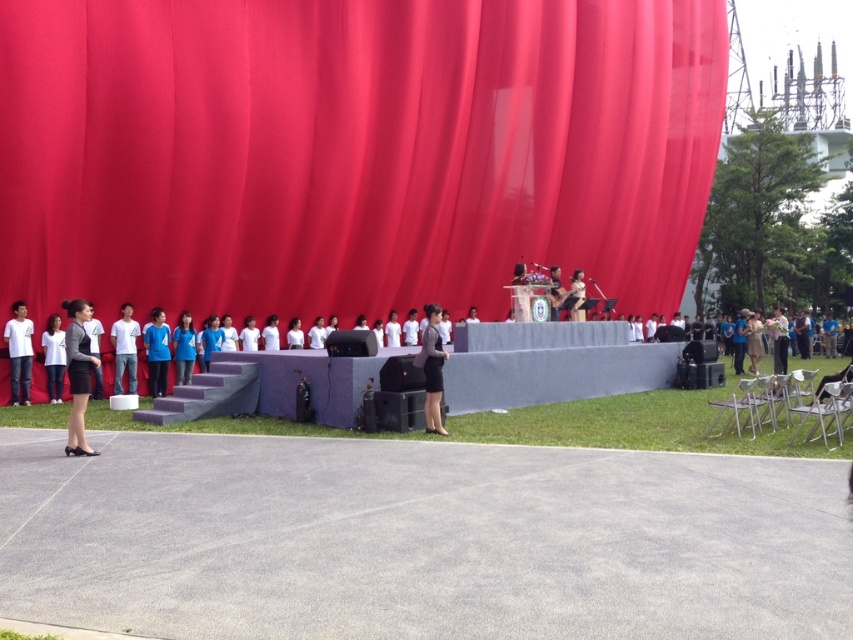
You are an event organizer who needs to place a banner that is 2 meters wide on the stage. The banner must be wider than the white matte shirt at left but narrower than the matte red curtain at center. Is this possible?

The matte red curtain at center is wider than the white matte shirt at left. Since the banner needs to be wider than the white matte shirt at left and narrower than the matte red curtain at center, it is possible as long as the banner is between their widths. The banner at 2 meters could fit if the curtain is wider than 2 meters and the shirt is narrower than 2 meters.

You are standing at the entrance of the stage and want to find the white matte shirt at center. According to the coordinates provided, in which direction should you look relative to your current position?

The white matte shirt at center is located at coordinates point (x=125, y=348), which means it is positioned to the right and slightly forward from your current position at the stage entrance.

You are a stagehand who needs to place a 10 meter long banner between the matte red curtain at center and the black fabric at right. Is there enough space to stretch the banner fully without folding it?

The distance between the matte red curtain at center and the black fabric at right is 8.46 meters. Since the banner is 10 meters long, it is longer than the available space. Therefore, the banner cannot be stretched fully without folding.